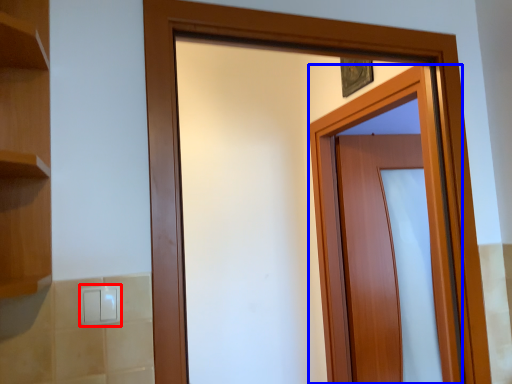
Question: Which of the following is the closest to the observer, light switch (highlighted by a red box) or door (highlighted by a blue box)?

Choices:
 (A) light switch
 (B) door

Answer: (A)